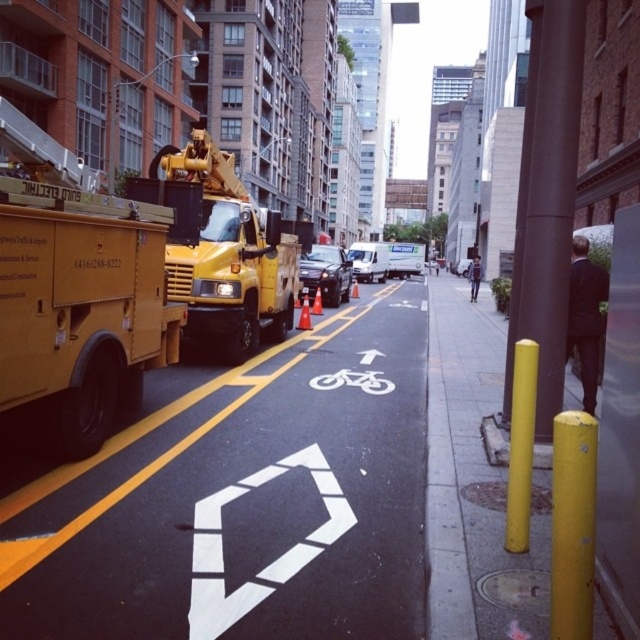
Question: Which point is farther from the camera taking this photo?

Choices:
 (A) (80, 200)
 (B) (220, 515)
 (C) (188, 189)

Answer: (C)

Question: In this image, where is matte yellow utility truck at left located relative to matte yellow truck at center?

Choices:
 (A) left
 (B) right

Answer: (B)

Question: Which object is closer to the camera taking this photo?

Choices:
 (A) matte yellow utility truck at left
 (B) white painted bike lane at center

Answer: (B)

Question: Among these objects, which one is farthest from the camera?

Choices:
 (A) matte yellow utility truck at left
 (B) matte yellow truck at center
 (C) white painted bike lane at center

Answer: (B)

Question: Is white painted bike lane at center positioned before matte yellow truck at center?

Choices:
 (A) yes
 (B) no

Answer: (A)

Question: Is white painted bike lane at center to the right of matte yellow utility truck at left from the viewer's perspective?

Choices:
 (A) no
 (B) yes

Answer: (B)